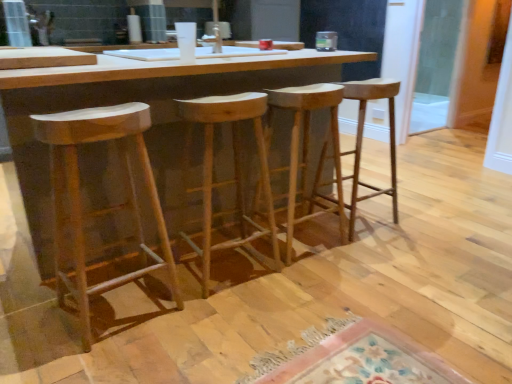
At what (x,y) coordinates should I click in order to perform the action: click on free area in between natural wood stool at center, which appears as the 3th stool when viewed from the right, and natural wood stool at center, the 2th stool when ordered from right to left. Please return your answer as a coordinate pair (x, y). This screenshot has height=384, width=512. Looking at the image, I should click on (288, 261).